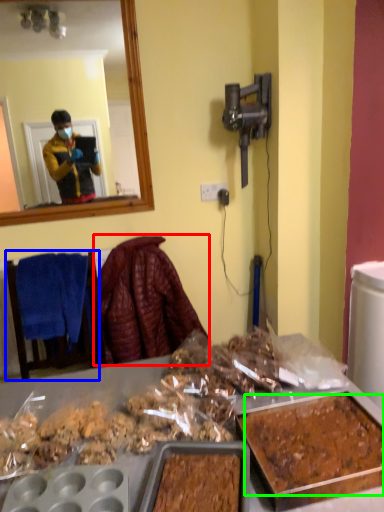
Question: Which object is positioned farthest from blanket (highlighted by a red box)? Select from furniture (highlighted by a blue box) and food (highlighted by a green box).

Choices:
 (A) furniture
 (B) food

Answer: (B)